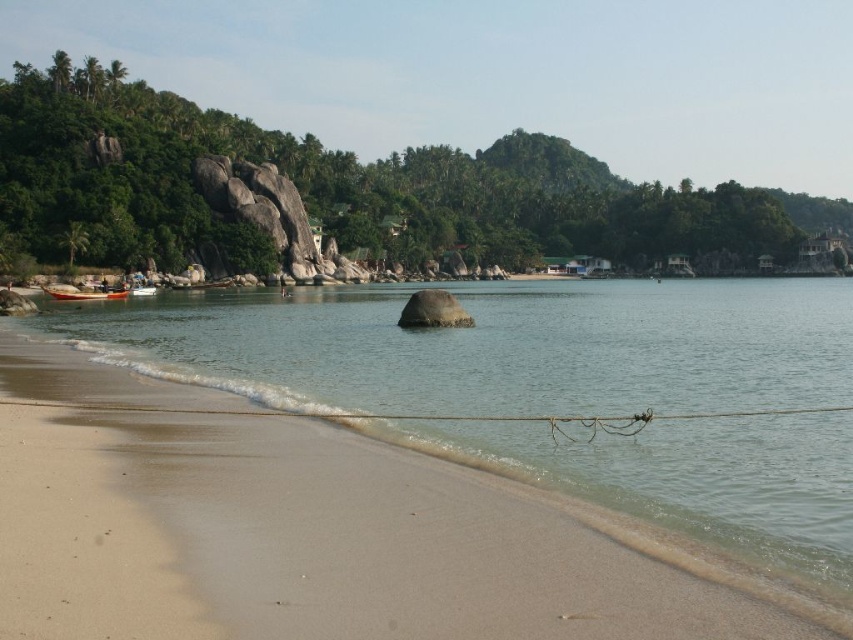
Which is below, clear water at beach front or wooden boat at lower left?

clear water at beach front is below.

Is clear water at beach front shorter than wooden boat at lower left?

In fact, clear water at beach front may be taller than wooden boat at lower left.

This screenshot has height=640, width=853. I want to click on clear water at beach front, so click(492, 346).

Find the location of `clear water at beach front`. clear water at beach front is located at coordinates (492, 346).